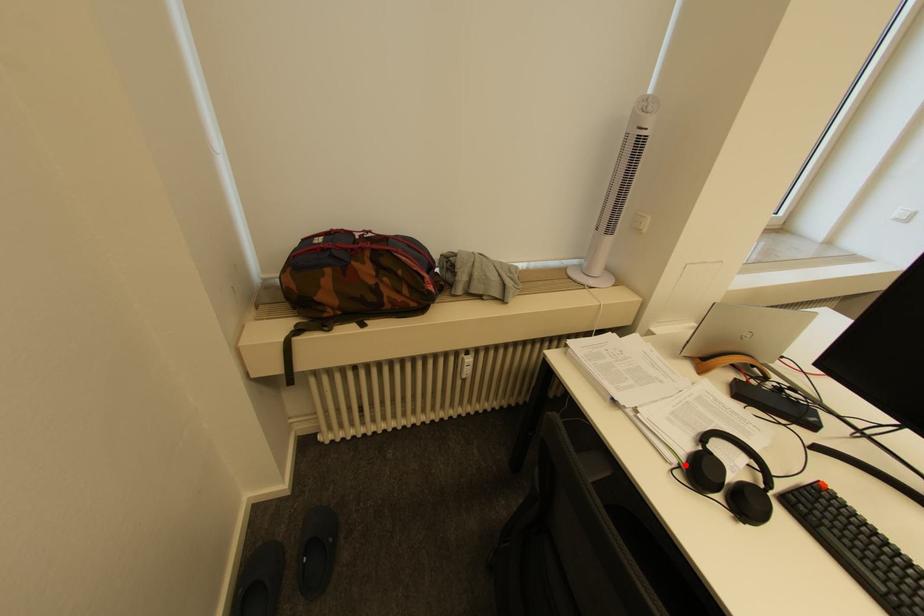
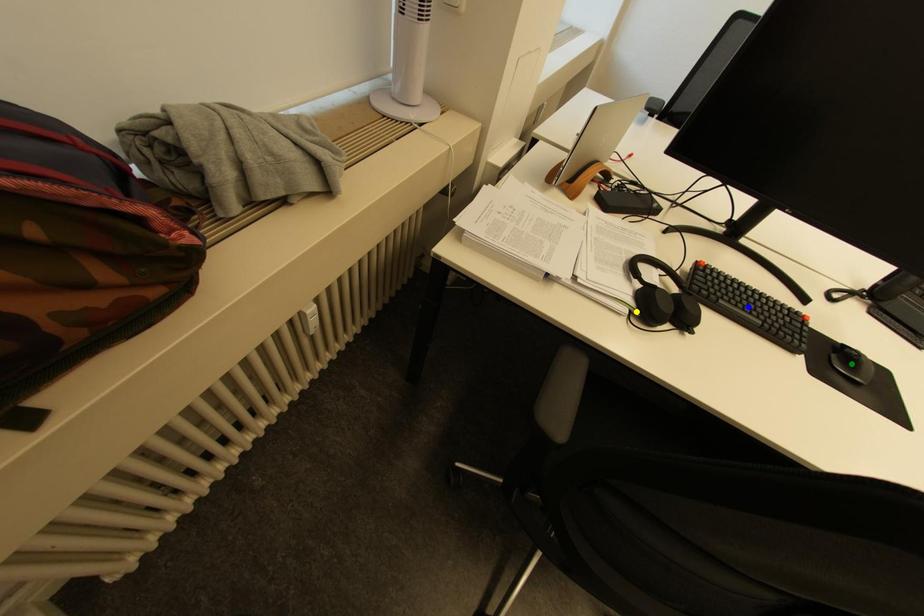
Question: I am providing you with two images of the same scene from different viewpoints. A red point is marked on the first image. You are given multiple points on the second image. Which spot in image 2 lines up with the point in image 1?

Choices:
 (A) green point
 (B) yellow point
 (C) blue point

Answer: (B)